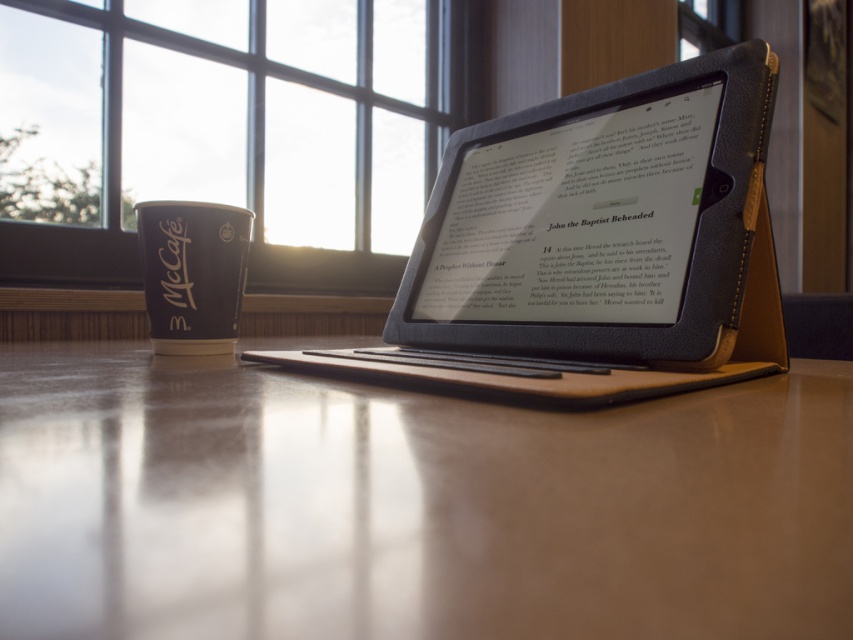
Is smooth wooden table at center to the right of leather-bound tablet at center from the viewer's perspective?

No, smooth wooden table at center is not to the right of leather-bound tablet at center.

Is point (695, 522) more distant than point (666, 141)?

No, (695, 522) is closer to viewer.

This screenshot has width=853, height=640. Describe the element at coordinates (412, 506) in the screenshot. I see `smooth wooden table at center` at that location.

Find the location of a particular element. This screenshot has height=640, width=853. smooth wooden table at center is located at coordinates (412, 506).

Who is lower down, smooth wooden table at center or clear glass window at upper center?

smooth wooden table at center is below.

Based on the photo, can you confirm if smooth wooden table at center is positioned to the right of clear glass window at upper center?

Indeed, smooth wooden table at center is positioned on the right side of clear glass window at upper center.

Which is behind, point (508, 444) or point (22, 154)?

Point (22, 154)

The width and height of the screenshot is (853, 640). Find the location of `smooth wooden table at center`. smooth wooden table at center is located at coordinates (412, 506).

Between smooth wooden table at center and black paper cup at left, which one is positioned higher?

black paper cup at left is higher up.

Looking at this image, measure the distance from smooth wooden table at center to black paper cup at left.

They are 16.81 inches apart.

Who is more forward, (24, 384) or (183, 328)?

Point (24, 384) is in front.

Image resolution: width=853 pixels, height=640 pixels. I want to click on smooth wooden table at center, so click(412, 506).